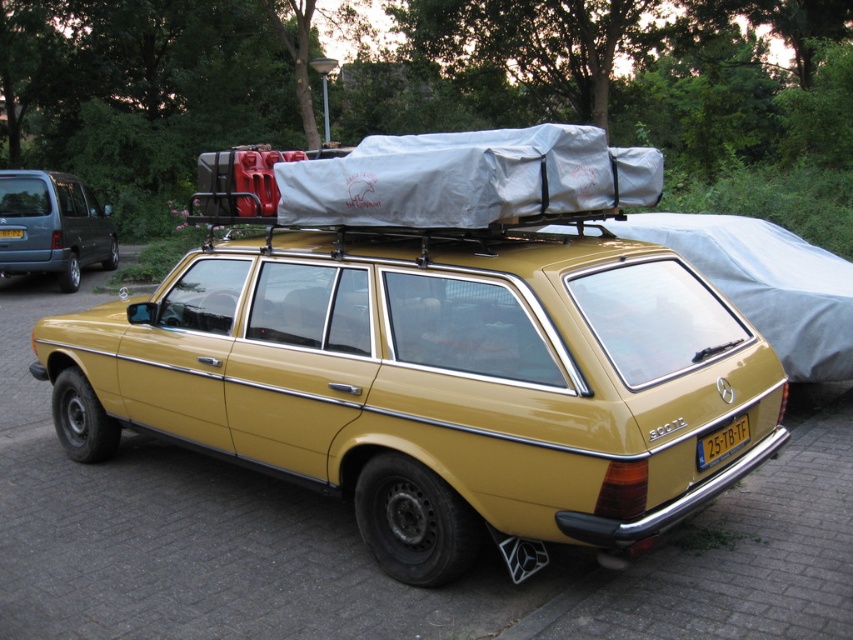
You are planning to park your car behind the gold matte station wagon at center and the metallic gray minivan at left. Which vehicle should you park behind to have more space in front of your car?

You should park behind the metallic gray minivan at left because it is taller than the gold matte station wagon at center, giving you more space in front of your car.

You are a pedestrian standing in front of the vintage Mercedes and want to see the yellow plastic license plate at rear clearly. Is the metallic gray minivan at left blocking your view of the license plate?

The metallic gray minivan at left is in front of the yellow plastic license plate at rear, so it is blocking your view of the license plate.